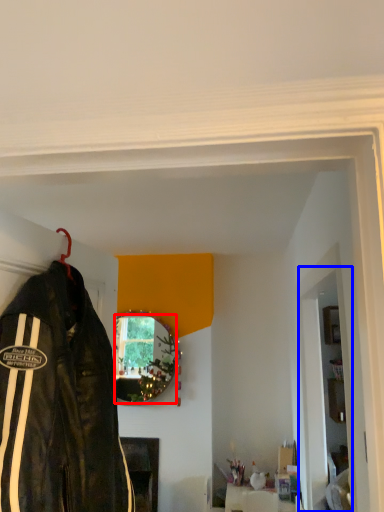
Question: Among these objects, which one is farthest to the camera, mirror (highlighted by a red box) or garage door (highlighted by a blue box)?

Choices:
 (A) mirror
 (B) garage door

Answer: (A)